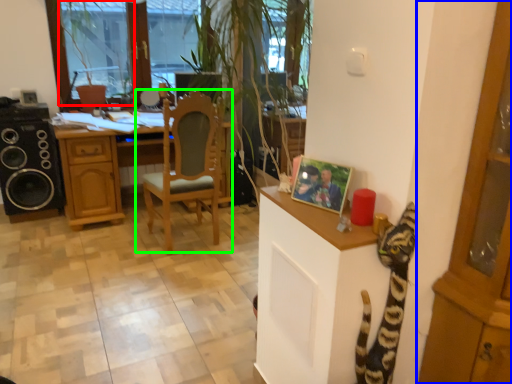
Question: Estimate the real-world distances between objects in this image. Which object is closer to window screen (highlighted by a red box), cabinetry (highlighted by a blue box) or chair (highlighted by a green box)?

Choices:
 (A) cabinetry
 (B) chair

Answer: (B)